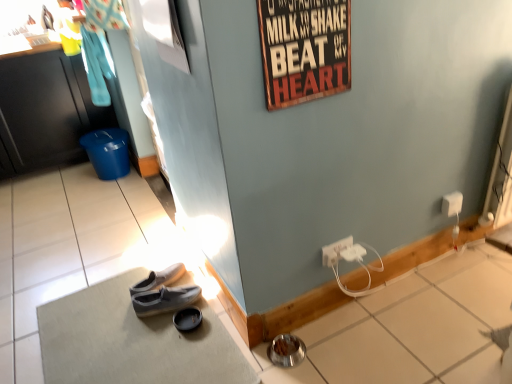
The width and height of the screenshot is (512, 384). I want to click on empty space that is to the right of matte gray shoe at center, the first footwear viewed from the right, so [221, 329].